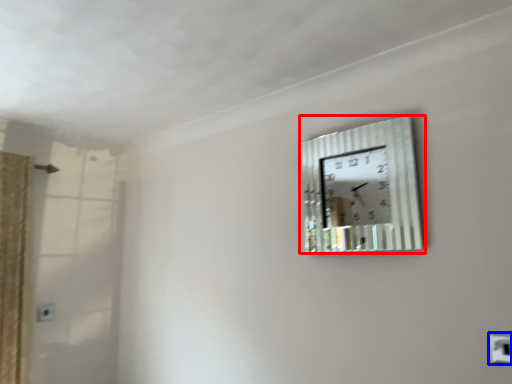
Question: Which object appears closest to the camera in this image, wall clock (highlighted by a red box) or electric outlet (highlighted by a blue box)?

Choices:
 (A) wall clock
 (B) electric outlet

Answer: (B)